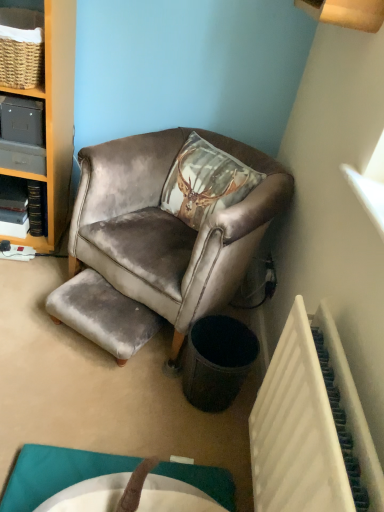
Question: Is black textured trash bin at lower right bigger than velvet brown armchair at center?

Choices:
 (A) yes
 (B) no

Answer: (B)

Question: Is the depth of black textured trash bin at lower right less than that of velvet brown armchair at center?

Choices:
 (A) yes
 (B) no

Answer: (B)

Question: Does black textured trash bin at lower right appear on the right side of velvet brown armchair at center?

Choices:
 (A) no
 (B) yes

Answer: (B)

Question: From the image's perspective, is black textured trash bin at lower right located above velvet brown armchair at center?

Choices:
 (A) no
 (B) yes

Answer: (A)

Question: From a real-world perspective, is black textured trash bin at lower right on top of velvet brown armchair at center?

Choices:
 (A) no
 (B) yes

Answer: (A)

Question: Is the position of black textured trash bin at lower right more distant than that of velvet brown armchair at center?

Choices:
 (A) no
 (B) yes

Answer: (B)

Question: Could you tell me if white plastic radiator at lower right is turned towards velvet grey stool at lower left?

Choices:
 (A) yes
 (B) no

Answer: (B)

Question: Considering the relative positions of white plastic radiator at lower right and velvet grey stool at lower left in the image provided, is white plastic radiator at lower right to the left of velvet grey stool at lower left from the viewer's perspective?

Choices:
 (A) yes
 (B) no

Answer: (B)

Question: Is white plastic radiator at lower right bigger than velvet grey stool at lower left?

Choices:
 (A) yes
 (B) no

Answer: (A)

Question: Is white plastic radiator at lower right not inside velvet grey stool at lower left?

Choices:
 (A) yes
 (B) no

Answer: (A)

Question: Is white plastic radiator at lower right wider than velvet grey stool at lower left?

Choices:
 (A) no
 (B) yes

Answer: (A)

Question: From the image's perspective, is white plastic radiator at lower right above velvet grey stool at lower left?

Choices:
 (A) no
 (B) yes

Answer: (A)

Question: Is matte gray cabinet at left to the left of velvet grey stool at lower left from the viewer's perspective?

Choices:
 (A) yes
 (B) no

Answer: (A)